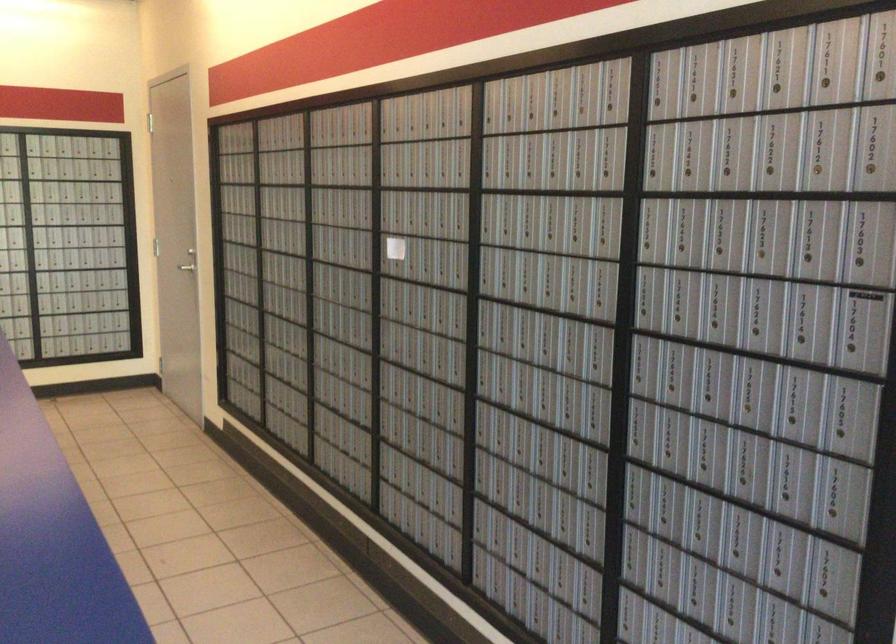
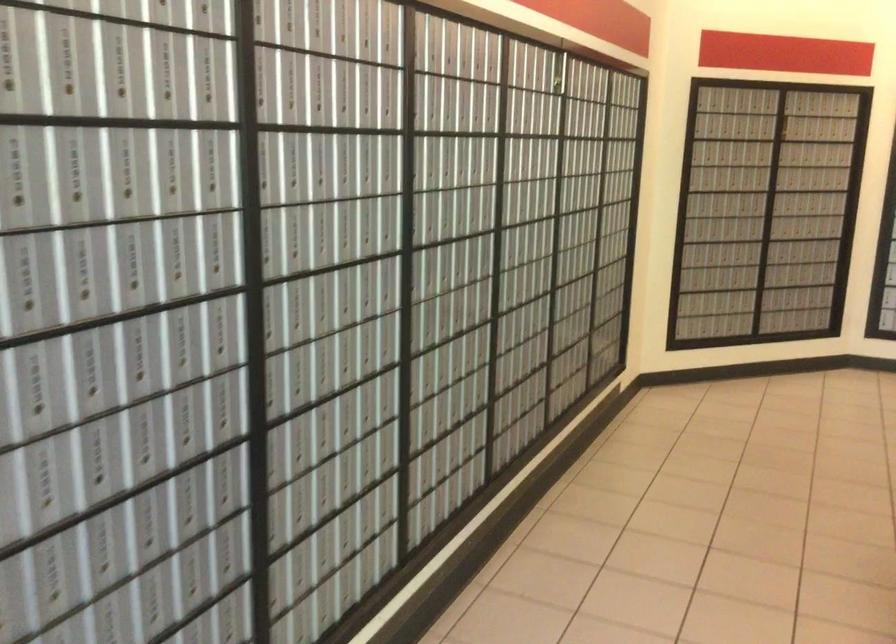
Question: The camera is either moving clockwise (left) or counter-clockwise (right) around the object. The first image is from the beginning of the video and the second image is from the end. Is the camera moving left or right when shooting the video?

Choices:
 (A) Left
 (B) Right

Answer: (B)